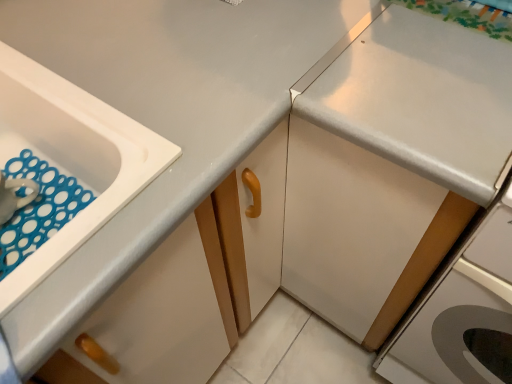
Question: Can you confirm if white plastic sink at left is smaller than white glossy countertop at upper right?

Choices:
 (A) yes
 (B) no

Answer: (A)

Question: Considering the relative sizes of white plastic sink at left and white glossy countertop at upper right in the image provided, is white plastic sink at left taller than white glossy countertop at upper right?

Choices:
 (A) no
 (B) yes

Answer: (A)

Question: Considering the relative sizes of white plastic sink at left and white glossy countertop at upper right in the image provided, is white plastic sink at left bigger than white glossy countertop at upper right?

Choices:
 (A) yes
 (B) no

Answer: (B)

Question: Does white plastic sink at left come behind white glossy countertop at upper right?

Choices:
 (A) yes
 (B) no

Answer: (B)

Question: From a real-world perspective, is white plastic sink at left located higher than white glossy countertop at upper right?

Choices:
 (A) yes
 (B) no

Answer: (A)

Question: Does white plastic sink at left come in front of white glossy countertop at upper right?

Choices:
 (A) no
 (B) yes

Answer: (B)

Question: Does white plastic sink at left have a lesser height compared to white glossy drawer at lower left?

Choices:
 (A) no
 (B) yes

Answer: (A)

Question: Is the depth of white plastic sink at left greater than that of white glossy drawer at lower left?

Choices:
 (A) no
 (B) yes

Answer: (B)

Question: Is white plastic sink at left to the right of white glossy drawer at lower left from the viewer's perspective?

Choices:
 (A) no
 (B) yes

Answer: (A)

Question: Is white plastic sink at left thinner than white glossy drawer at lower left?

Choices:
 (A) yes
 (B) no

Answer: (B)

Question: Is white plastic sink at left outside of white glossy drawer at lower left?

Choices:
 (A) no
 (B) yes

Answer: (B)

Question: Is white plastic sink at left facing towards white glossy drawer at lower left?

Choices:
 (A) yes
 (B) no

Answer: (A)

Question: Would you say white glossy drawer at lower left is a long distance from white glossy countertop at upper right?

Choices:
 (A) no
 (B) yes

Answer: (A)